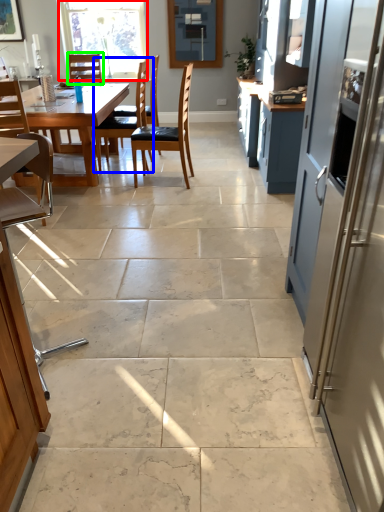
Question: Considering the real-world distances, which object is closest to window (highlighted by a red box)? chair (highlighted by a blue box) or chair (highlighted by a green box).

Choices:
 (A) chair
 (B) chair

Answer: (B)